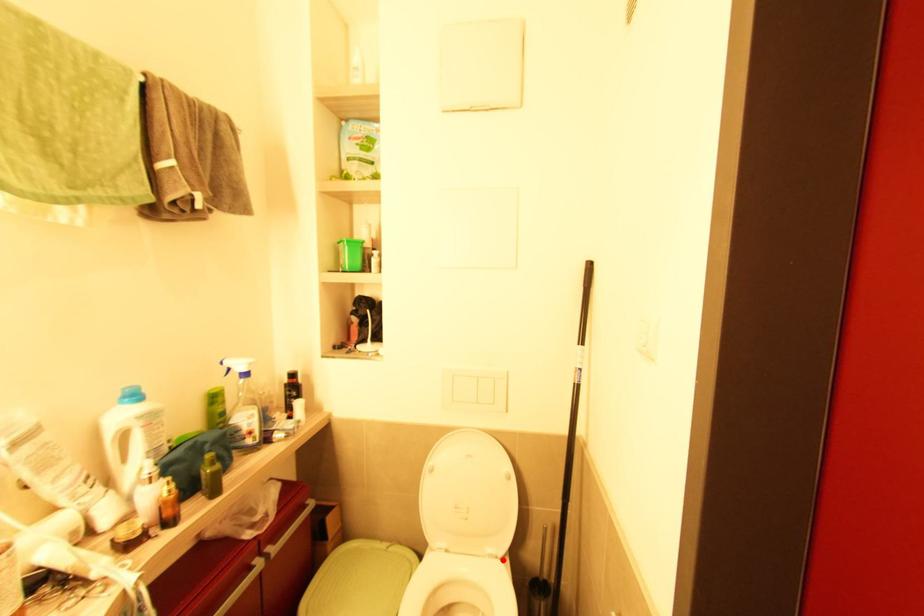
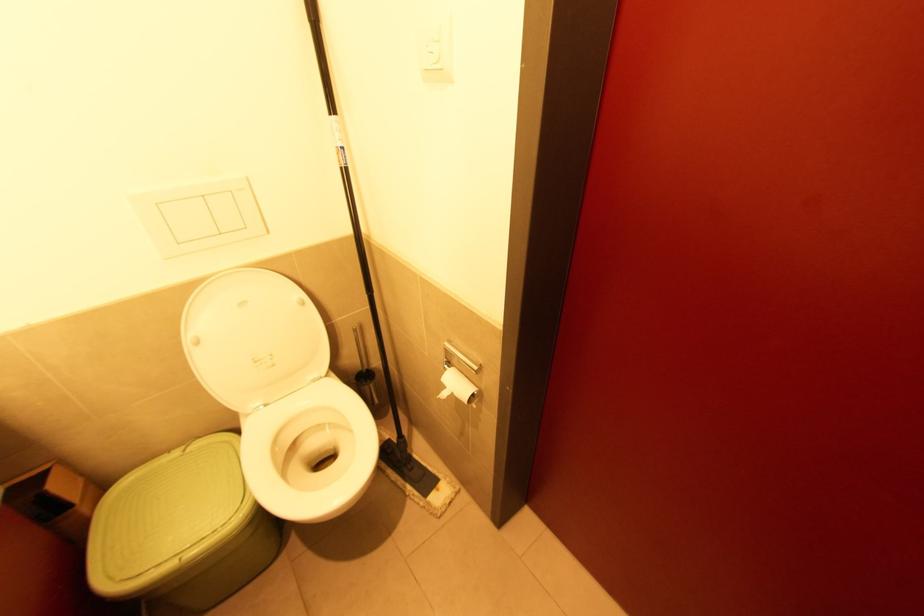
Question: I am providing you with two images of the same scene from different viewpoints. A red point is shown in image1. For the corresponding object point in image2, is it positioned nearer or farther from the camera?

Choices:
 (A) Nearer
 (B) Farther

Answer: (A)